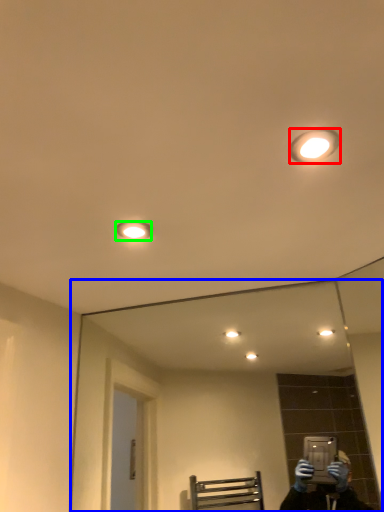
Question: Considering the real-world distances, which object is closest to light fixture (highlighted by a red box)? mirror (highlighted by a blue box) or light fixture (highlighted by a green box).

Choices:
 (A) mirror
 (B) light fixture

Answer: (B)